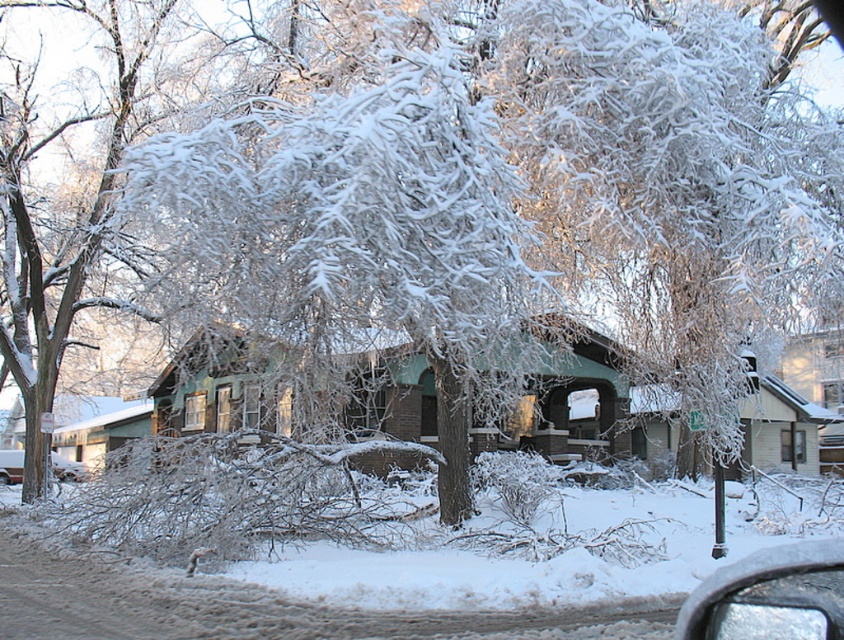
Question: Does clear glass mirror at lower right have a lesser width compared to metallic silver car at lower left?

Choices:
 (A) no
 (B) yes

Answer: (B)

Question: Is clear glass mirror at lower right positioned before metallic silver car at lower left?

Choices:
 (A) yes
 (B) no

Answer: (A)

Question: Which point is closer to the camera?

Choices:
 (A) (63, 468)
 (B) (828, 547)

Answer: (B)

Question: Which point appears closest to the camera in this image?

Choices:
 (A) (57, 454)
 (B) (836, 547)

Answer: (B)

Question: Does clear glass mirror at lower right have a smaller size compared to metallic silver car at lower left?

Choices:
 (A) no
 (B) yes

Answer: (B)

Question: Which point appears farthest from the camera in this image?

Choices:
 (A) 58,464
 (B) 832,552

Answer: (A)